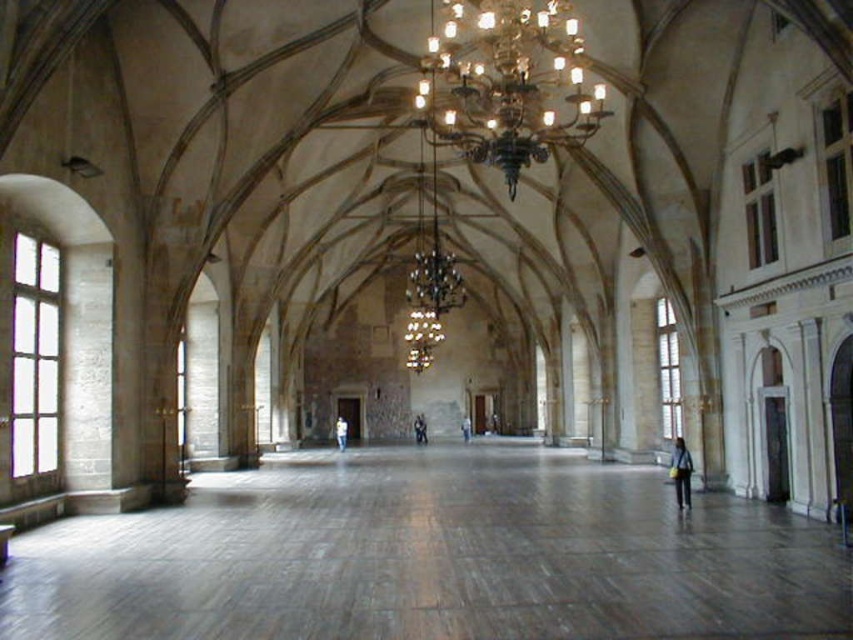
Does point (679, 461) come behind point (335, 428)?

No, (679, 461) is closer to viewer.

Is light blue denim jacket at lower right bigger than light blue jeans at center?

Actually, light blue denim jacket at lower right might be smaller than light blue jeans at center.

Describe the element at coordinates (680, 472) in the screenshot. I see `light blue denim jacket at lower right` at that location.

Locate an element on the screen. light blue denim jacket at lower right is located at coordinates (680, 472).

Which is behind, point (482, 74) or point (424, 426)?

The point (424, 426) is more distant.

Who is more forward, (457, 118) or (425, 440)?

Point (457, 118)

This screenshot has width=853, height=640. I want to click on gold metallic chandelier at upper center, so pos(508,84).

Who is more distant from viewer, (480, 109) or (341, 426)?

The point (341, 426) is more distant.

Does point (456, 92) lie in front of point (339, 419)?

Yes, it is in front of point (339, 419).

Who is more distant from viewer, (461, 58) or (341, 448)?

Point (341, 448)

Locate an element on the screen. gold metallic chandelier at upper center is located at coordinates (508, 84).